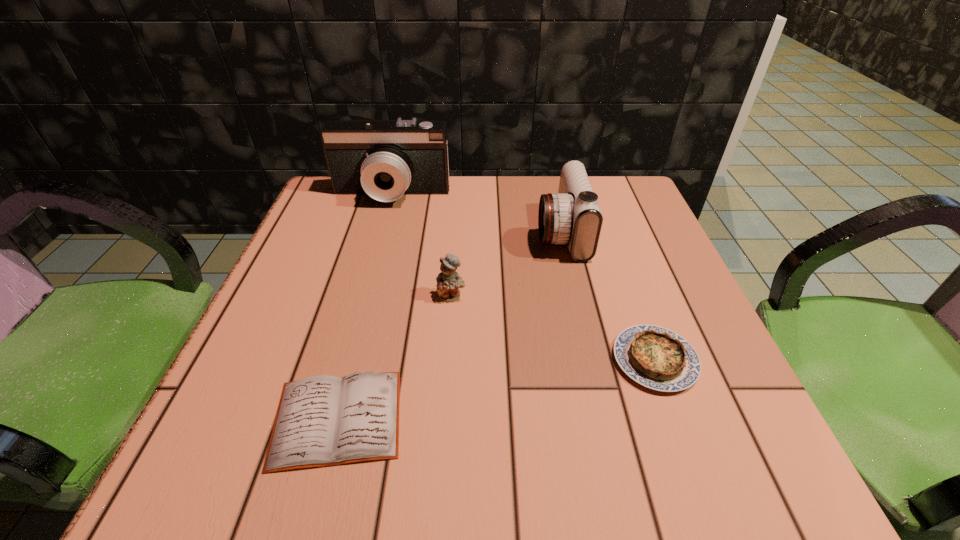
Where is `vacant space located 0.150m on the surface of the shorter camcorder`? vacant space located 0.150m on the surface of the shorter camcorder is located at coordinates tap(468, 233).

Image resolution: width=960 pixels, height=540 pixels. In order to click on blank area located on the surface of the shorter camcorder in this screenshot , I will do `click(496, 233)`.

Where is `vacant space situated 0.180m on the front-facing side of the third nearest object`? vacant space situated 0.180m on the front-facing side of the third nearest object is located at coordinates (445, 388).

Locate an element on the screen. vacant space located on the back of the quiche is located at coordinates tap(626, 282).

Where is `vacant space located on the back of the shortest object`? The image size is (960, 540). vacant space located on the back of the shortest object is located at coordinates (360, 334).

Where is `object situated at the near edge`? The height and width of the screenshot is (540, 960). object situated at the near edge is located at coordinates (321, 421).

Find the location of a particular element. This screenshot has width=960, height=540. camcorder present at the left edge is located at coordinates (385, 159).

This screenshot has height=540, width=960. Identify the location of diary situated at the left edge. (321, 421).

Image resolution: width=960 pixels, height=540 pixels. What are the coordinates of `camcorder at the right edge` in the screenshot? It's located at (572, 216).

Where is `quiche present at the right edge`? quiche present at the right edge is located at coordinates (655, 357).